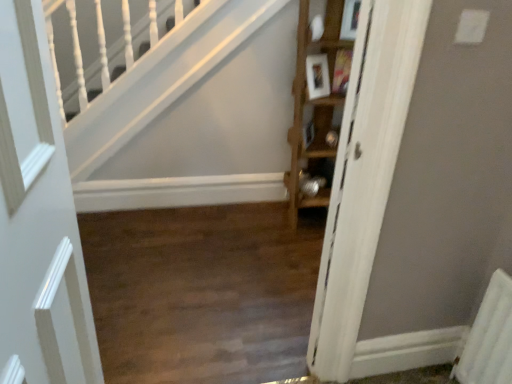
Question: Should I look upward or downward to see white matte door at left?

Choices:
 (A) up
 (B) down

Answer: (B)

Question: Is wooden cabinet at right located within white matte door at left?

Choices:
 (A) yes
 (B) no

Answer: (B)

Question: From the image's perspective, would you say white matte door at left is shown under wooden cabinet at right?

Choices:
 (A) yes
 (B) no

Answer: (A)

Question: Is white matte door at left bigger than wooden cabinet at right?

Choices:
 (A) no
 (B) yes

Answer: (A)

Question: Is white matte door at left aimed at wooden cabinet at right?

Choices:
 (A) no
 (B) yes

Answer: (A)

Question: Is white matte door at left not within wooden cabinet at right?

Choices:
 (A) no
 (B) yes

Answer: (B)

Question: Does white matte door at left lie in front of wooden cabinet at right?

Choices:
 (A) yes
 (B) no

Answer: (A)

Question: From a real-world perspective, is wooden cabinet at right positioned under wooden floor at center based on gravity?

Choices:
 (A) no
 (B) yes

Answer: (A)

Question: Does wooden cabinet at right turn towards wooden floor at center?

Choices:
 (A) no
 (B) yes

Answer: (A)

Question: Considering the relative positions of wooden cabinet at right and wooden floor at center in the image provided, is wooden cabinet at right in front of wooden floor at center?

Choices:
 (A) yes
 (B) no

Answer: (B)

Question: Considering the relative positions of wooden cabinet at right and wooden floor at center in the image provided, is wooden cabinet at right behind wooden floor at center?

Choices:
 (A) no
 (B) yes

Answer: (B)

Question: Can you confirm if wooden cabinet at right is positioned to the right of wooden floor at center?

Choices:
 (A) no
 (B) yes

Answer: (B)

Question: From a real-world perspective, is wooden cabinet at right on wooden floor at center?

Choices:
 (A) yes
 (B) no

Answer: (A)

Question: Considering the relative sizes of wooden floor at center and wooden cabinet at right in the image provided, is wooden floor at center wider than wooden cabinet at right?

Choices:
 (A) yes
 (B) no

Answer: (A)